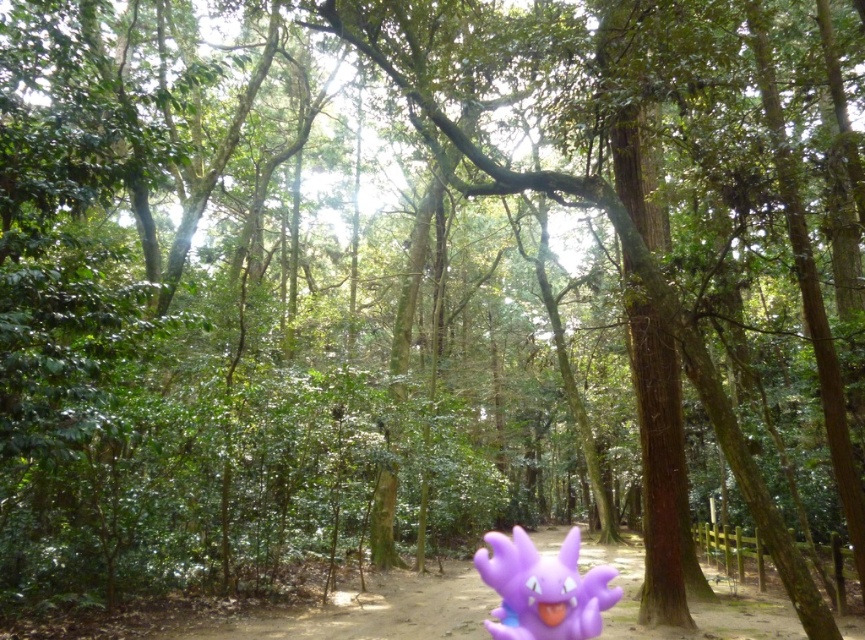
You are a hiker who wants to place a small marker between the purple plastic toy at center and the purple matte toy at lower center. Which toy requires the marker to be placed closer to the center of the path?

The purple plastic toy at center has a larger width than the purple matte toy at lower center, so the marker should be placed closer to the purple plastic toy at center to account for its greater width.

You are a hiker who just found a purple plastic toy at center and a purple matte toy at lower center in the forest. You want to place both toys on a shelf in your backpack that is 6 feet wide. Can you fit both toys side by side on the shelf?

The purple plastic toy at center and purple matte toy at lower center are 6.62 feet apart from each other, so they cannot be placed side by side on a 6 feet wide shelf since the combined width would exceed the shelf width.

Looking at this image, you are a hiker who has lost a small, purple plastic toy in the forest. According to the map coordinates provided, where should you look to find the purple plastic toy at center?

The purple plastic toy at center is located at point coordinates (x=373, y=611) according to the map provided.